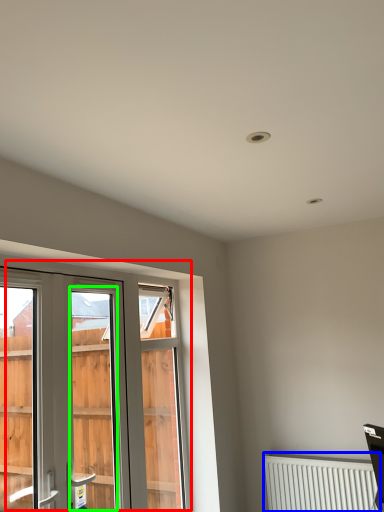
Question: Based on their relative distances, which object is nearer to window (highlighted by a red box)? Choose from radiator (highlighted by a blue box) and screen door (highlighted by a green box).

Choices:
 (A) radiator
 (B) screen door

Answer: (A)